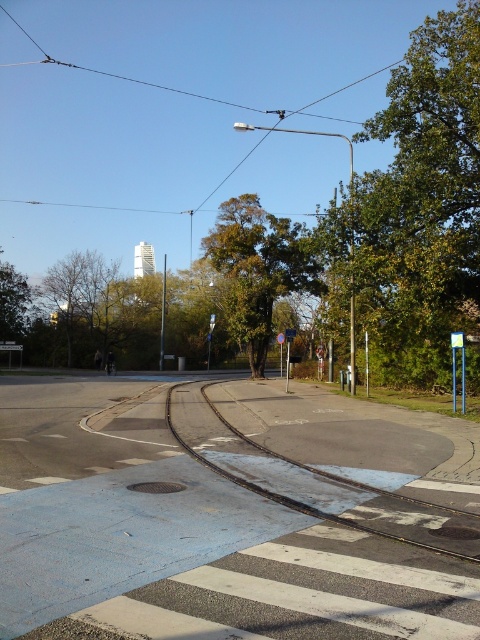
Question: Which of these objects is positioned closest to the green leafy tree at left?

Choices:
 (A) green leafy tree at upper right
 (B) smooth asphalt train track at center
 (C) green leafy tree at center
 (D) green leafy tree at upper center

Answer: (D)

Question: Which point is farther to the camera?

Choices:
 (A) (242, 193)
 (B) (220, 419)
 (C) (75, 253)
 (D) (13, 342)

Answer: (A)

Question: Can you confirm if green leafy tree at center is thinner than green leafy tree at left?

Choices:
 (A) yes
 (B) no

Answer: (A)

Question: Which object is positioned closest to the green leafy tree at upper right?

Choices:
 (A) smooth asphalt train track at center
 (B) green leafy tree at upper center
 (C) green leafy tree at left

Answer: (A)

Question: Can you confirm if green leafy tree at center is positioned above smooth asphalt train track at center?

Choices:
 (A) yes
 (B) no

Answer: (A)

Question: Can you confirm if green leafy tree at upper right is positioned to the right of smooth asphalt train track at center?

Choices:
 (A) yes
 (B) no

Answer: (A)